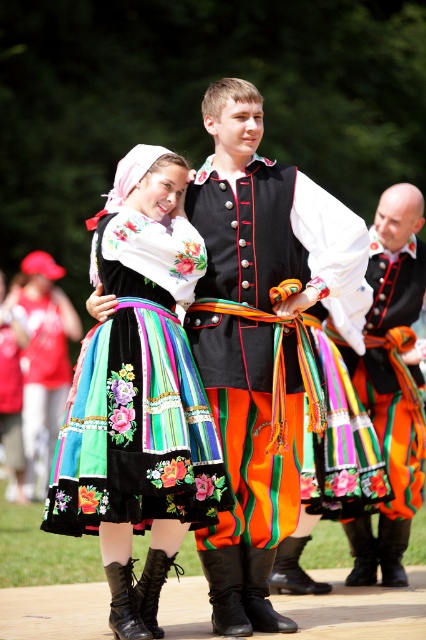
You are a fashion designer observing the two individuals in the scene. Both are wearing a velvet black vest at center and a matte black vest at center. Which vest is positioned higher on their bodies?

The velvet black vest at center is above the matte black vest at center, so the velvet one is higher.

You are an observer standing in front of the scene. You notice the embroidered fabric dress at center and the matte black vest at center. Which one appears higher in the image?

The embroidered fabric dress at center is located above the matte black vest at center, so it appears higher in the image.